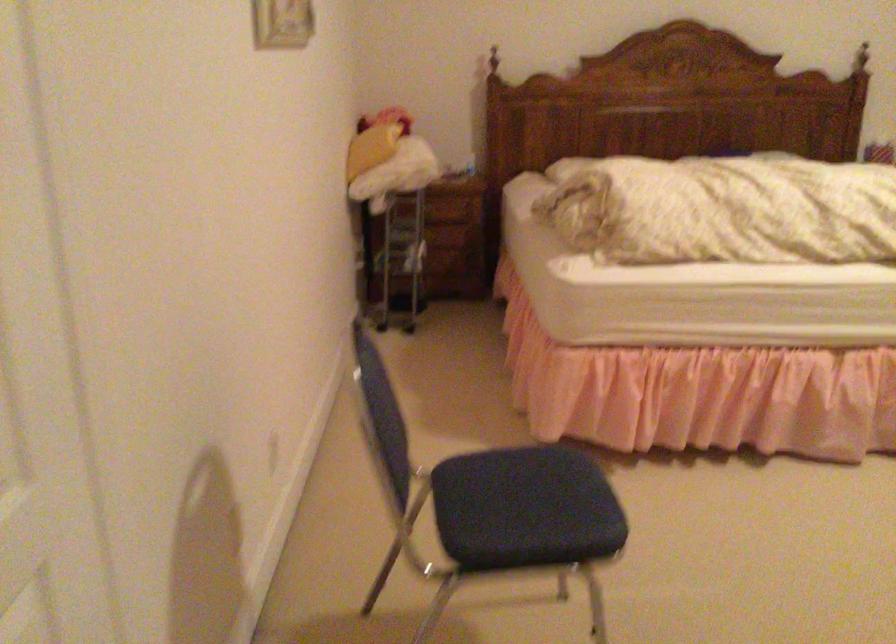
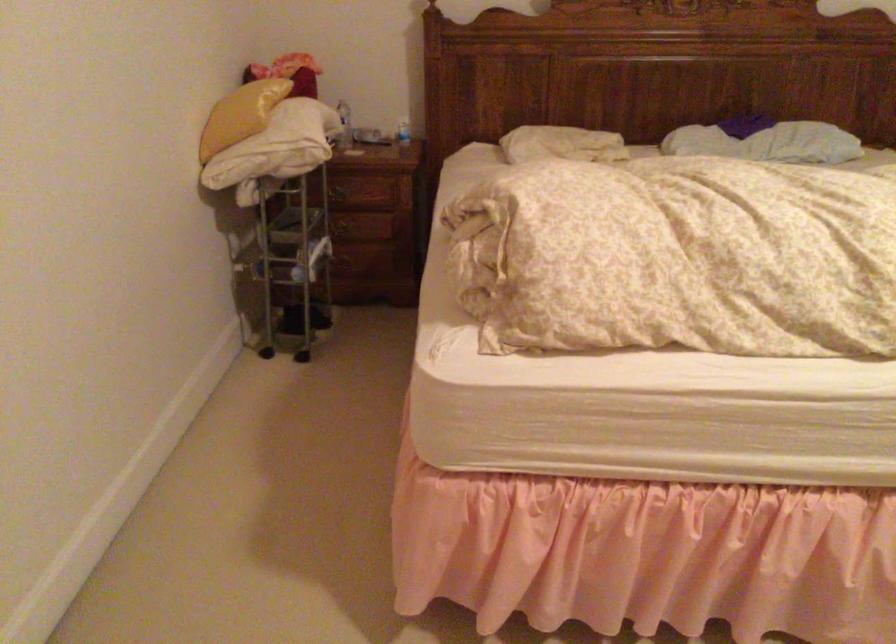
Where in the second image is the point corresponding to pixel 366 140 from the first image?

(240, 115)